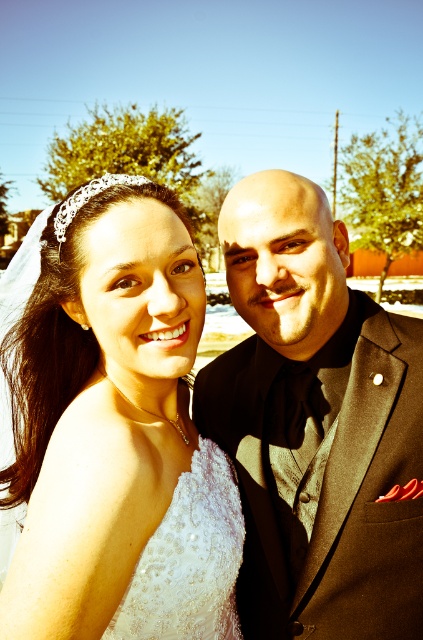
You are a photographer at a wedding and need to ensure the dresses are arranged properly. According to the image, which dress, the white satin dress at center or the ivory lace dress at center, is placed on top?

The white satin dress at center is positioned over the ivory lace dress at center, so the white satin dress at center is placed on top.

You are a photographer adjusting your camera settings to capture the couple in the best possible light. Since the black satin suit at right and ivory lace dress at center are both in focus, which one should you adjust your camera to prioritize focusing on if you want the closer subject to be sharp?

The black satin suit at right is closer to the viewer than the ivory lace dress at center, so you should prioritize focusing on the black satin suit at right to ensure the closer subject is sharp.

You are a photographer at a wedding. You need to position a light source to the left of the ivory lace dress at center so that it illuminates the black satin suit at right. Is the light source placement possible given their positions?

The black satin suit at right is to the right of the ivory lace dress at center. Therefore, placing the light source to the left of the ivory lace dress at center would still allow the light to reach the black satin suit at right as it is positioned further to the right.